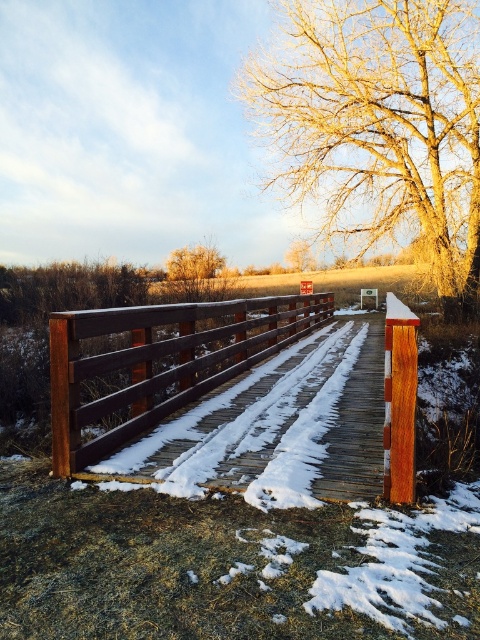
Does brown wooden bridge at center appear on the right side of bare brown tree at upper center?

Incorrect, brown wooden bridge at center is not on the right side of bare brown tree at upper center.

Can you confirm if brown wooden bridge at center is shorter than bare brown tree at upper center?

No.

Is point (140, 396) behind point (309, 253)?

No, (140, 396) is closer to viewer.

This screenshot has height=640, width=480. I want to click on brown wooden bridge at center, so click(x=160, y=358).

Does golden textured tree at upper right have a greater width compared to brown wooden bridge at center?

Yes, golden textured tree at upper right is wider than brown wooden bridge at center.

Based on the photo, who is higher up, golden textured tree at upper right or brown wooden bridge at center?

golden textured tree at upper right is above.

The image size is (480, 640). I want to click on golden textured tree at upper right, so click(x=380, y=124).

What are the coordinates of `golden textured tree at upper right` in the screenshot? It's located at (380, 124).

Consider the image. Between golden textured tree at upper right and brown textured tree at center, which one appears on the right side from the viewer's perspective?

golden textured tree at upper right is more to the right.

Who is shorter, golden textured tree at upper right or brown textured tree at center?

Standing shorter between the two is brown textured tree at center.

Between point (304, 12) and point (207, 273), which one is positioned in front?

Point (304, 12) is in front.

Locate an element on the screen. golden textured tree at upper right is located at coordinates (380, 124).